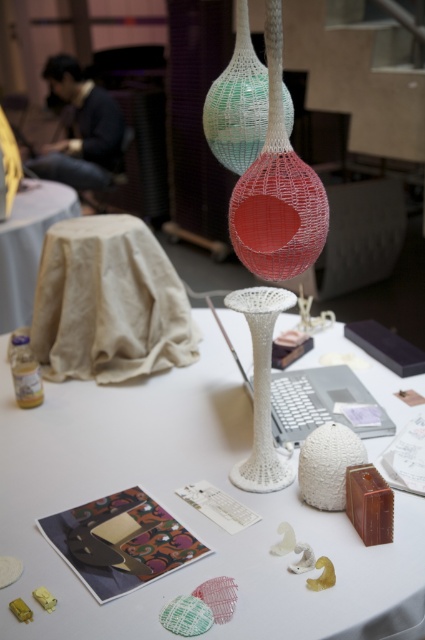
Is point (422, 586) positioned behind point (272, 180)?

No.

Can you confirm if white matte vase at center is positioned to the right of white mesh vase at upper center?

No, white matte vase at center is not to the right of white mesh vase at upper center.

You are a GUI agent. You are given a task and a screenshot of the screen. Output one action in this format:
    pyautogui.click(x=<x>, y=<y>)
    Task: Click on the white matte vase at center
    
    Given the screenshot: What is the action you would take?
    pyautogui.click(x=187, y=512)

Describe the element at coordinates (187, 512) in the screenshot. I see `white matte vase at center` at that location.

Can you confirm if white matte vase at center is smaller than white mesh vase at center?

Actually, white matte vase at center might be larger than white mesh vase at center.

Is point (132, 449) closer to viewer compared to point (288, 305)?

No, (132, 449) is behind (288, 305).

Find the location of a particular element. This screenshot has height=640, width=425. white matte vase at center is located at coordinates (187, 512).

Is the position of white matte vase at center less distant than that of beige fabric-covered table at center?

Yes, it is.

Is white matte vase at center bigger than beige fabric-covered table at center?

Yes.

Is point (37, 429) more distant than point (45, 228)?

No.

Identify the location of white matte vase at center. The height and width of the screenshot is (640, 425). (187, 512).